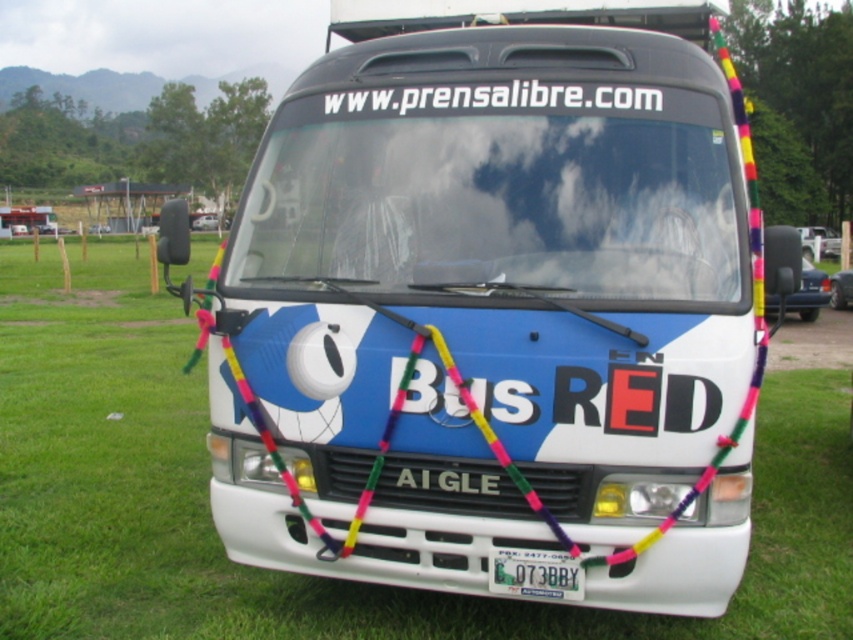
Can you confirm if green grass at center is taller than white matte text at center?

Correct, green grass at center is much taller as white matte text at center.

Between green grass at center and white matte text at center, which one appears on the right side from the viewer's perspective?

From the viewer's perspective, white matte text at center appears more on the right side.

The height and width of the screenshot is (640, 853). Describe the element at coordinates (289, 573) in the screenshot. I see `green grass at center` at that location.

The width and height of the screenshot is (853, 640). Identify the location of green grass at center. (289, 573).

Does white matte text at center have a smaller size compared to green metallic license plate at center?

No, white matte text at center is not smaller than green metallic license plate at center.

Does white matte text at center have a greater width compared to green metallic license plate at center?

Yes, white matte text at center is wider than green metallic license plate at center.

Which is in front, point (415, 106) or point (526, 573)?

Point (526, 573)

At what (x,y) coordinates should I click in order to perform the action: click on white matte text at center. Please return your answer as a coordinate pair (x, y). Image resolution: width=853 pixels, height=640 pixels. Looking at the image, I should click on (494, 97).

Who is higher up, green grass at center or green metallic license plate at center?

green grass at center is higher up.

Between point (428, 611) and point (572, 580), which one is positioned behind?

Positioned behind is point (428, 611).

Locate an element on the screen. green grass at center is located at coordinates (289, 573).

Locate an element on the screen. Image resolution: width=853 pixels, height=640 pixels. green grass at center is located at coordinates (289, 573).